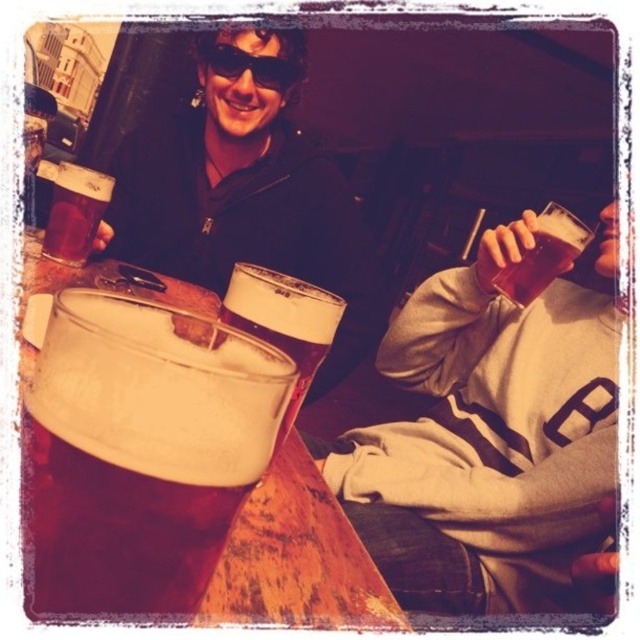
Question: Among these objects, which one is nearest to the camera?

Choices:
 (A) translucent amber liquid at upper right
 (B) translucent glass mug at center

Answer: (B)

Question: Does brown frothy beer at lower left appear over translucent glass at left?

Choices:
 (A) yes
 (B) no

Answer: (B)

Question: Where is brown frothy beer at lower left located in relation to translucent glass at left in the image?

Choices:
 (A) left
 (B) right

Answer: (B)

Question: Does matte black jacket at upper center appear on the right side of translucent amber liquid at upper right?

Choices:
 (A) no
 (B) yes

Answer: (A)

Question: Which of the following is the farthest from the observer?

Choices:
 (A) translucent glass at left
 (B) matte black jacket at upper center

Answer: (B)

Question: Which of the following is the closest to the observer?

Choices:
 (A) (45, 458)
 (B) (289, 86)

Answer: (A)